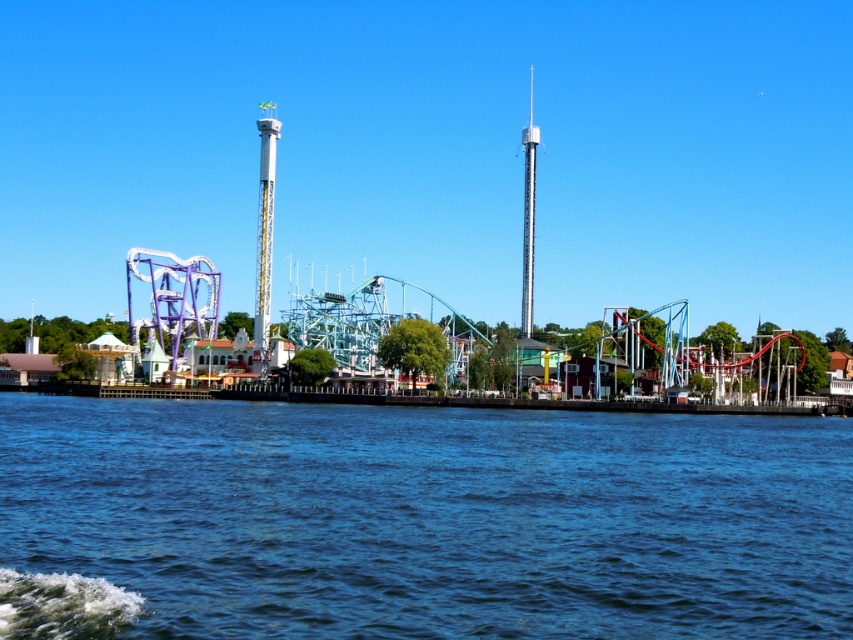
Question: Does metallic roller coaster at center have a smaller size compared to yellow metallic tower at center?

Choices:
 (A) yes
 (B) no

Answer: (B)

Question: Is the position of blue water at lower left more distant than that of metallic roller coaster at center?

Choices:
 (A) no
 (B) yes

Answer: (A)

Question: Estimate the real-world distances between objects in this image. Which object is closer to the metallic roller coaster at center?

Choices:
 (A) yellow metallic tower at center
 (B) metallic silver tower at center

Answer: (A)

Question: Can you confirm if blue water at lower left is thinner than metallic roller coaster at center?

Choices:
 (A) no
 (B) yes

Answer: (B)

Question: Estimate the real-world distances between objects in this image. Which object is farther from the yellow metallic tower at center?

Choices:
 (A) metallic silver tower at center
 (B) metallic roller coaster at center
 (C) blue water at lower left

Answer: (C)

Question: Estimate the real-world distances between objects in this image. Which object is closer to the metallic roller coaster at center?

Choices:
 (A) blue water at lower left
 (B) yellow metallic tower at center

Answer: (B)